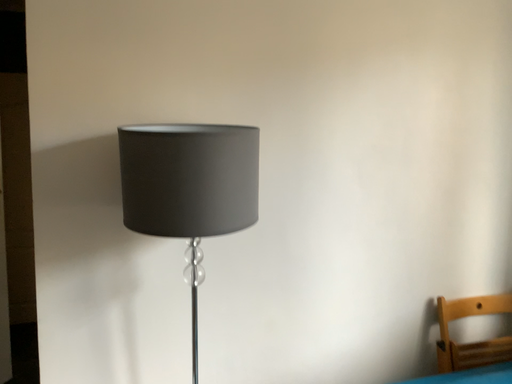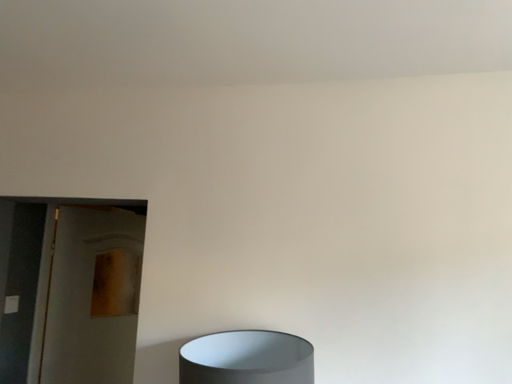
Question: How did the camera likely rotate when shooting the video?

Choices:
 (A) rotated right
 (B) rotated left

Answer: (B)